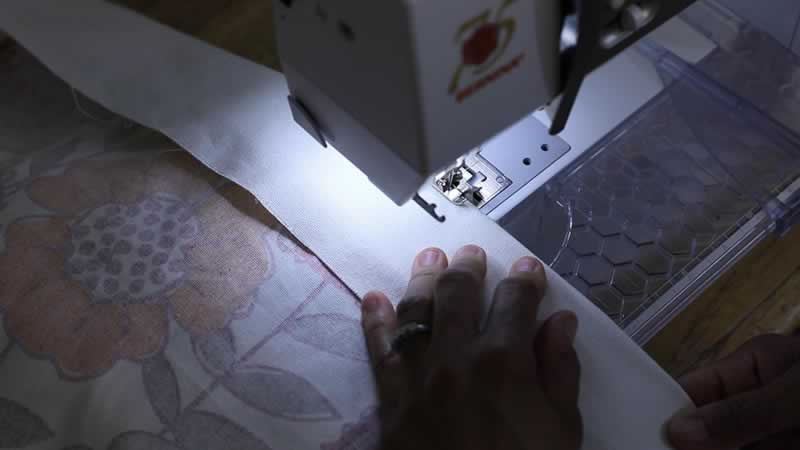
Identify the location of sewing machine. The width and height of the screenshot is (800, 450). (469, 124).